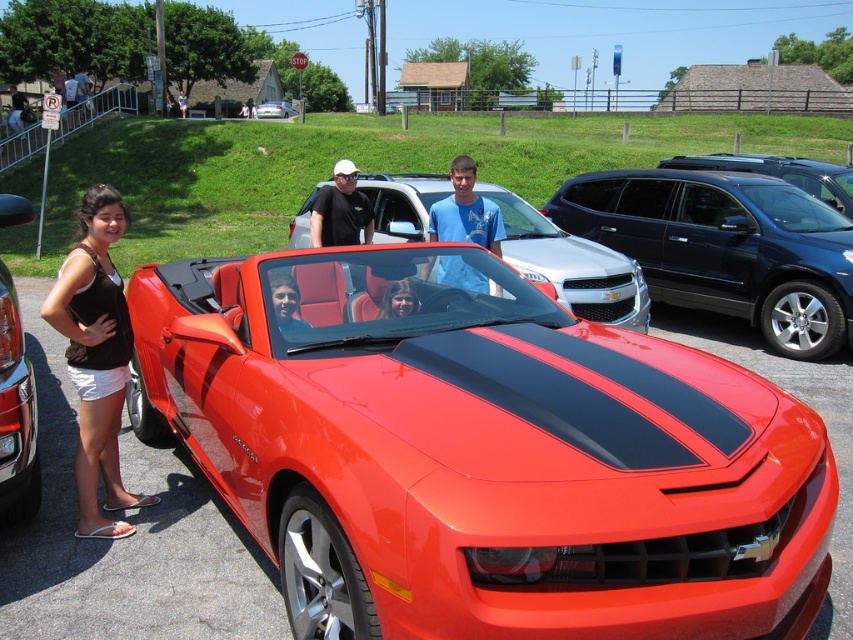
Question: Among these points, which one is farthest from the camera?

Choices:
 (A) pos(379,230)
 (B) pos(415,294)
 (C) pos(848,234)

Answer: (A)

Question: Which object is the farthest from the glossy black suv at right?

Choices:
 (A) shiny red convertible at center
 (B) glossy orange car at left

Answer: (B)

Question: Is glossy orange car at left closer to camera compared to blue cotton shirt at center?

Choices:
 (A) yes
 (B) no

Answer: (A)

Question: Is glossy black suv at right to the right of blue cotton shirt at center from the viewer's perspective?

Choices:
 (A) yes
 (B) no

Answer: (A)

Question: Which point is farther to the camera?

Choices:
 (A) (398, 291)
 (B) (35, 483)
 (C) (598, 284)
 (D) (340, 236)

Answer: (C)

Question: Does glossy orange car at left have a lesser width compared to smooth skin face at center?

Choices:
 (A) no
 (B) yes

Answer: (B)